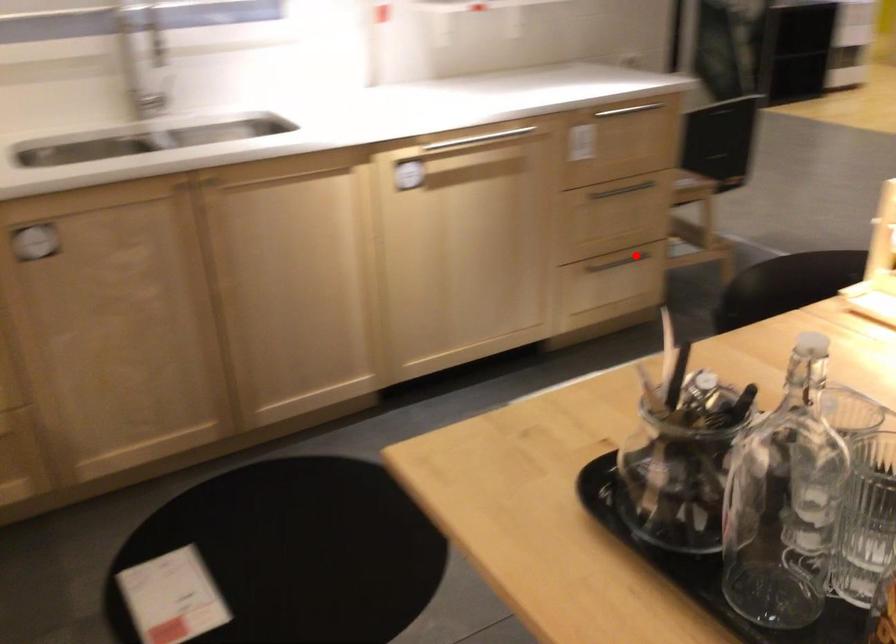
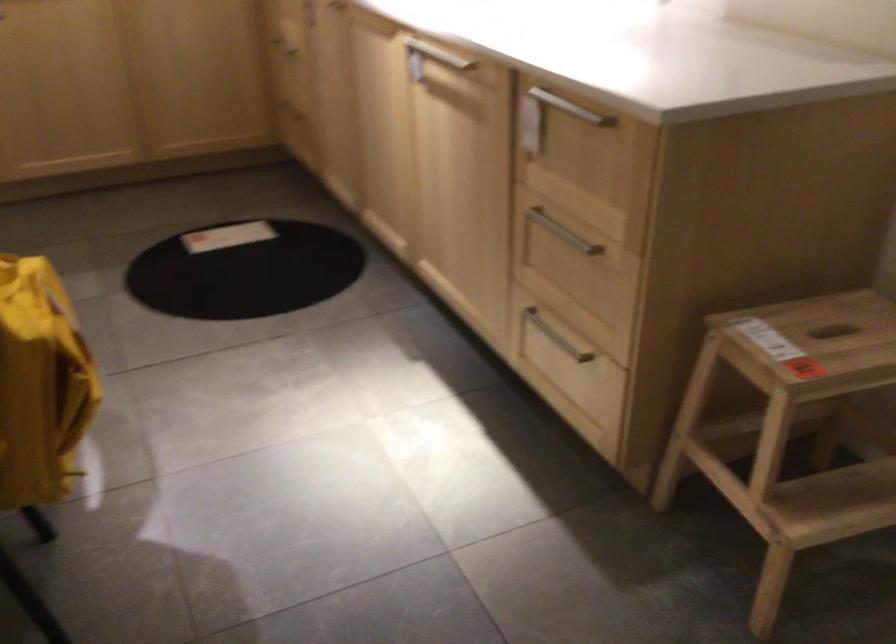
Question: I am providing you with two images of the same scene from different viewpoints. A red point is shown in image1. For the corresponding object point in image2, is it positioned nearer or farther from the camera?

Choices:
 (A) Nearer
 (B) Farther

Answer: (A)